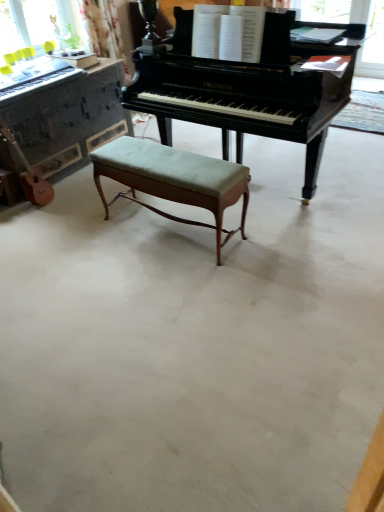
Image resolution: width=384 pixels, height=512 pixels. I want to click on free space in front of glossy black piano at center, the first piano positioned from the right, so click(253, 278).